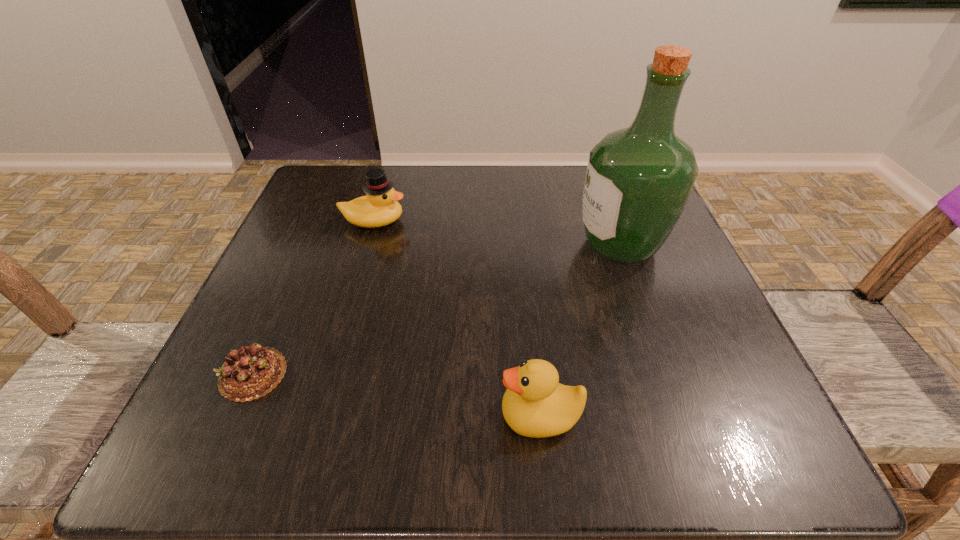
Locate an element on the screen. This screenshot has height=540, width=960. free space between the shortest object and the tallest object is located at coordinates (437, 309).

Locate an element on the screen. The height and width of the screenshot is (540, 960). free space between the shortest object and the right duck is located at coordinates (396, 395).

Where is `free space between the liquor and the shortest object`? This screenshot has width=960, height=540. free space between the liquor and the shortest object is located at coordinates (437, 309).

What are the coordinates of `empty space that is in between the tallest object and the shortest object` in the screenshot? It's located at (437, 309).

This screenshot has height=540, width=960. What are the coordinates of `vacant region between the shortest object and the tallest object` in the screenshot? It's located at (437, 309).

What are the coordinates of `free space that is in between the shortest object and the third object from left to right` in the screenshot? It's located at (396, 395).

You are a GUI agent. You are given a task and a screenshot of the screen. Output one action in this format:
    pyautogui.click(x=<x>, y=<y>)
    Task: Click on the vacant area between the liquor and the third object from left to right
    The image size is (960, 540).
    Given the screenshot: What is the action you would take?
    pyautogui.click(x=580, y=330)

What are the coordinates of `free space between the chocolate cake and the right duck` in the screenshot? It's located at (396, 395).

Locate an element on the screen. This screenshot has width=960, height=540. empty space that is in between the rightmost object and the farther duck is located at coordinates (x=496, y=233).

At what (x,y) coordinates should I click in order to perform the action: click on vacant area between the right duck and the farther duck. Please return your answer as a coordinate pair (x, y). Looking at the image, I should click on (457, 318).